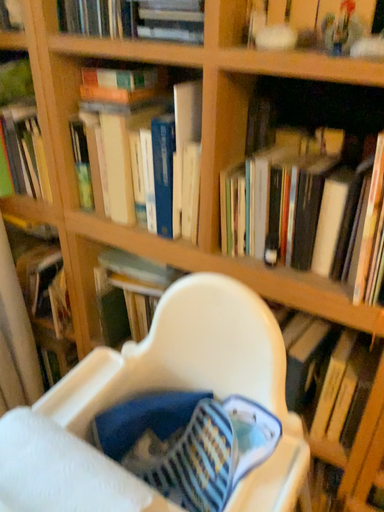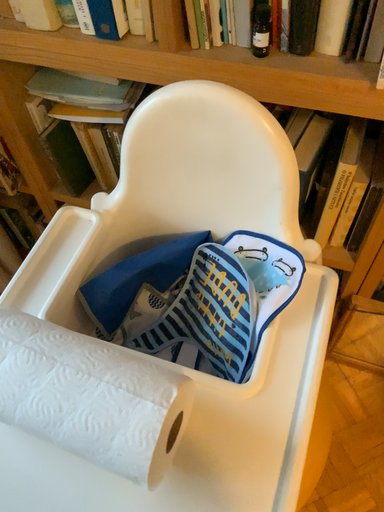
Question: Which way did the camera rotate in the video?

Choices:
 (A) rotated right
 (B) rotated left

Answer: (A)